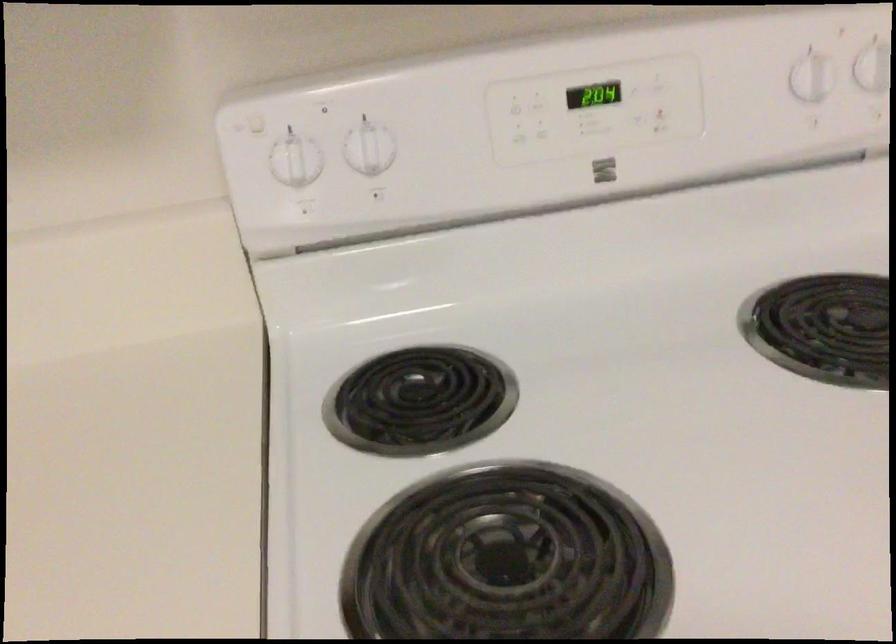
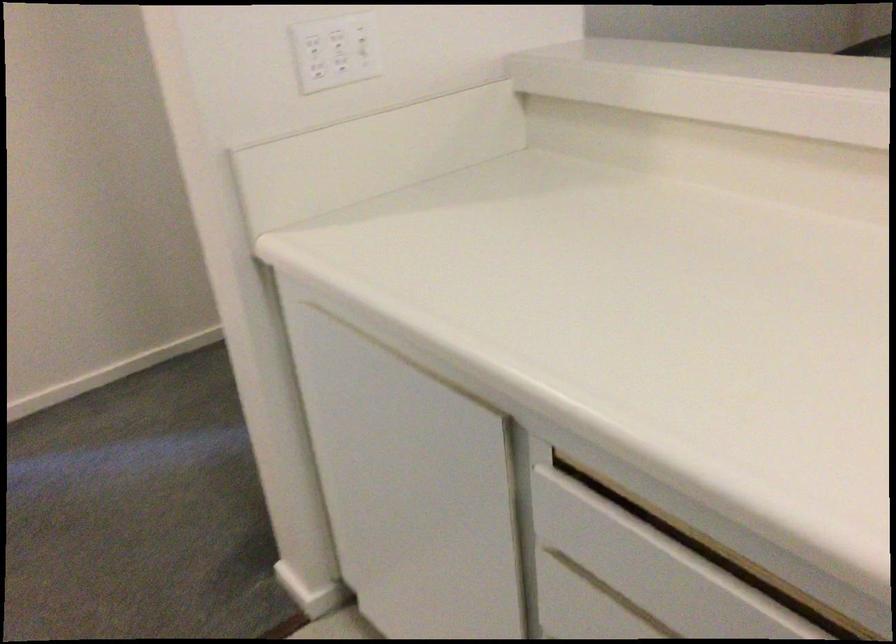
How did the camera likely rotate?

The camera rotated toward right-down.